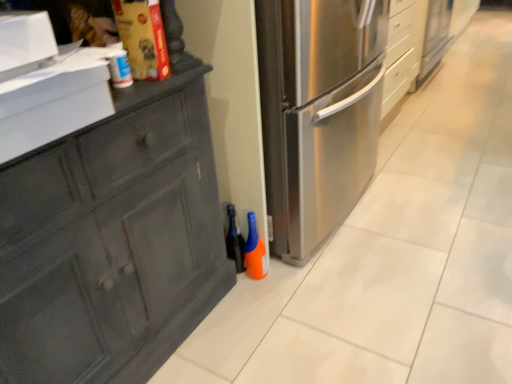
Locate an element on the screen. free spot in front of translucent orange spray bottle at lower center, which is the first bottle from left to right is located at coordinates (246, 293).